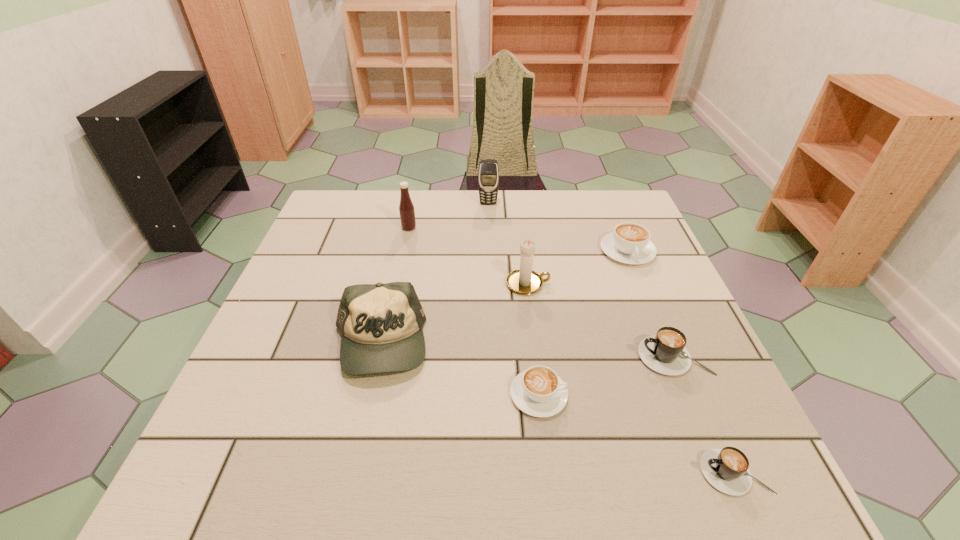
This screenshot has height=540, width=960. What are the coordinates of `object that stands as the fifth closest to the white candle holder` in the screenshot? It's located at click(406, 208).

Identify which cappuccino is the nearest to the farther black cappuccino. Please provide its 2D coordinates. Your answer should be formatted as a tuple, i.e. [(x, y)], where the tuple contains the x and y coordinates of a point satisfying the conditions above.

[(726, 469)]

Select which cappuccino appears as the third closest to the third object from left to right. Please provide its 2D coordinates. Your answer should be formatted as a tuple, i.e. [(x, y)], where the tuple contains the x and y coordinates of a point satisfying the conditions above.

[(538, 391)]

At what (x,y) coordinates should I click in order to perform the action: click on free region that satisfies the following two spatial constraints: 1. on the handle side of the white candle holder; 2. on the front-facing side of the baseball cap. Please return your answer as a coordinate pair (x, y). Looking at the image, I should click on (535, 343).

Identify the location of free spot that satisfies the following two spatial constraints: 1. on the side of the right white cappuccino with the handle; 2. on the handle side of the white candle holder. The height and width of the screenshot is (540, 960). (640, 284).

Locate an element on the screen. vacant region that satisfies the following two spatial constraints: 1. on the side of the third farthest object with the handle; 2. on the side of the leftmost cappuccino with the handle is located at coordinates (686, 395).